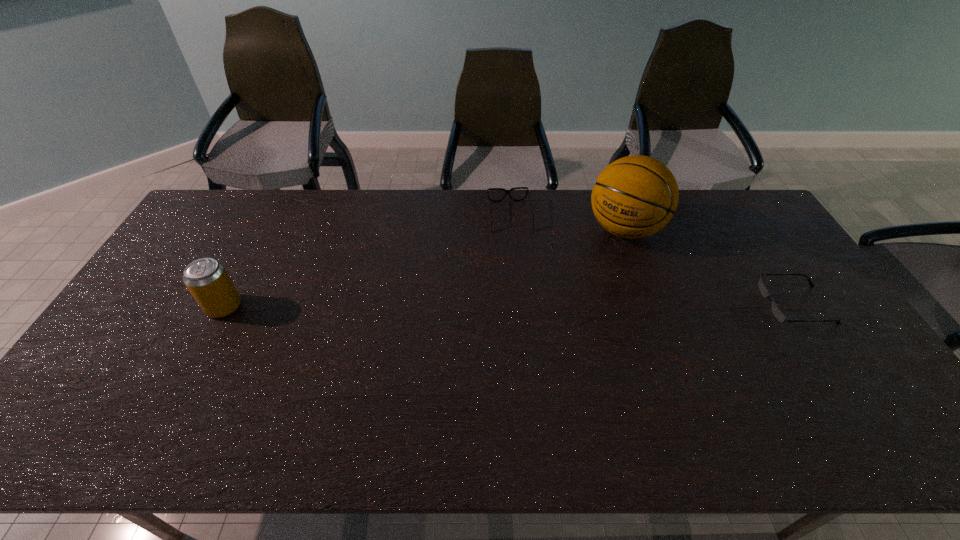
The image size is (960, 540). What are the coordinates of `pop (soda)` in the screenshot? It's located at (207, 280).

Find the location of a particular element. the leftmost object is located at coordinates (207, 280).

This screenshot has width=960, height=540. What are the coordinates of `the nearer spectacles` in the screenshot? It's located at (777, 312).

Identify the location of the rightmost object. The height and width of the screenshot is (540, 960). (777, 312).

You are a GUI agent. You are given a task and a screenshot of the screen. Output one action in this format:
    pyautogui.click(x=<x>, y=<y>)
    Task: Click on the taller spectacles
    The width and height of the screenshot is (960, 540).
    Given the screenshot: What is the action you would take?
    pyautogui.click(x=506, y=191)

Locate an element on the screen. This screenshot has height=540, width=960. the left spectacles is located at coordinates (506, 191).

Find the location of a particular element. The image size is (960, 540). the tallest object is located at coordinates (635, 196).

The width and height of the screenshot is (960, 540). I want to click on basketball, so click(635, 196).

I want to click on vacant region located 0.330m on the right of the second tallest object, so click(356, 307).

In order to click on free space located on the front-facing side of the right spectacles in this screenshot , I will do `click(691, 305)`.